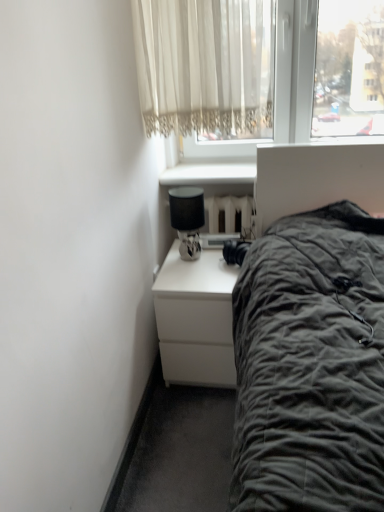
Measure the distance between white matte nightstand at lower center and camera.

1.64 meters.

What do you see at coordinates (187, 218) in the screenshot? I see `matte black lamp at upper right` at bounding box center [187, 218].

Where is `white lace curtain at upper center`? The image size is (384, 512). white lace curtain at upper center is located at coordinates point(205,67).

In order to click on white matte nightstand at lower center in this screenshot , I will do `click(196, 319)`.

This screenshot has width=384, height=512. In order to click on nightstand on the right of white lace curtain at upper center in this screenshot , I will do `click(196, 319)`.

Which of these two, white lace curtain at upper center or white matte nightstand at lower center, is bigger?

white matte nightstand at lower center is bigger.

Considering the sizes of objects white lace curtain at upper center and white matte nightstand at lower center in the image provided, who is wider, white lace curtain at upper center or white matte nightstand at lower center?

Wider between the two is white matte nightstand at lower center.

Is white matte nightstand at lower center at the back of white lace curtain at upper center?

white lace curtain at upper center does not have its back to white matte nightstand at lower center.

Is matte black lamp at upper right oriented towards white lace curtain at upper center?

No, matte black lamp at upper right is not turned towards white lace curtain at upper center.

Can you confirm if matte black lamp at upper right is wider than white lace curtain at upper center?

In fact, matte black lamp at upper right might be narrower than white lace curtain at upper center.

Would you say matte black lamp at upper right is to the left or to the right of white lace curtain at upper center in the picture?

In the image, matte black lamp at upper right appears on the left side of white lace curtain at upper center.

Is matte black lamp at upper right next to white lace curtain at upper center?

No, matte black lamp at upper right is not touching white lace curtain at upper center.

Is point (161, 353) closer or farther from the camera than point (240, 66)?

Point (161, 353) is farther from the camera than point (240, 66).

Considering the relative sizes of white matte nightstand at lower center and white lace curtain at upper center in the image provided, is white matte nightstand at lower center thinner than white lace curtain at upper center?

In fact, white matte nightstand at lower center might be wider than white lace curtain at upper center.

From a real-world perspective, between white matte nightstand at lower center and white lace curtain at upper center, who is vertically lower?

white matte nightstand at lower center is physically lower.

Does point (216, 97) appear closer or farther from the camera than point (191, 213)?

Point (216, 97) is closer to the camera than point (191, 213).

Consider the image. Is matte black lamp at upper right at the back of white lace curtain at upper center?

No, matte black lamp at upper right is not at the back of white lace curtain at upper center.

Does white lace curtain at upper center contain matte black lamp at upper right?

No, matte black lamp at upper right is located outside of white lace curtain at upper center.

Is point (195, 246) positioned before point (214, 335)?

No, (195, 246) is further to viewer.

Are matte black lamp at upper right and white matte nightstand at lower center located far from each other?

matte black lamp at upper right is near white matte nightstand at lower center, not far away.

Based on the photo, from a real-world perspective, which object stands above the other?

matte black lamp at upper right, from a real-world perspective.

Considering the relative sizes of matte black lamp at upper right and white matte nightstand at lower center in the image provided, is matte black lamp at upper right bigger than white matte nightstand at lower center?

Actually, matte black lamp at upper right might be smaller than white matte nightstand at lower center.

Can you confirm if white matte nightstand at lower center is thinner than matte black lamp at upper right?

In fact, white matte nightstand at lower center might be wider than matte black lamp at upper right.

Considering the positions of objects white matte nightstand at lower center and matte black lamp at upper right in the image provided, who is more to the left, white matte nightstand at lower center or matte black lamp at upper right?

matte black lamp at upper right.

From a real-world perspective, which object rests below the other?

white matte nightstand at lower center is physically lower.

Does white matte nightstand at lower center turn towards matte black lamp at upper right?

No, white matte nightstand at lower center does not turn towards matte black lamp at upper right.

Image resolution: width=384 pixels, height=512 pixels. I want to click on nightstand below the white lace curtain at upper center (from the image's perspective), so click(x=196, y=319).

Where is `lamp below the white lace curtain at upper center (from a real-world perspective)`? The image size is (384, 512). lamp below the white lace curtain at upper center (from a real-world perspective) is located at coordinates (187, 218).

Considering their positions, is white lace curtain at upper center positioned closer to white matte nightstand at lower center than matte black lamp at upper right?

The object closer to white matte nightstand at lower center is matte black lamp at upper right.

Looking at the image, which one is located closer to matte black lamp at upper right, white lace curtain at upper center or white matte nightstand at lower center?

white matte nightstand at lower center lies closer to matte black lamp at upper right than the other object.

When comparing their distances from white lace curtain at upper center, does white matte nightstand at lower center or matte black lamp at upper right seem further?

Based on the image, white matte nightstand at lower center appears to be further to white lace curtain at upper center.

Looking at the image, which one is located further to white matte nightstand at lower center, matte black lamp at upper right or white lace curtain at upper center?

The object further to white matte nightstand at lower center is white lace curtain at upper center.

From the image, which object appears to be farther from white lace curtain at upper center, matte black lamp at upper right or white matte nightstand at lower center?

white matte nightstand at lower center.

Estimate the real-world distances between objects in this image. Which object is further from matte black lamp at upper right, white matte nightstand at lower center or white lace curtain at upper center?

white lace curtain at upper center lies further to matte black lamp at upper right than the other object.

Locate an element on the screen. The height and width of the screenshot is (512, 384). lamp between white lace curtain at upper center and white matte nightstand at lower center in the up-down direction is located at coordinates click(187, 218).